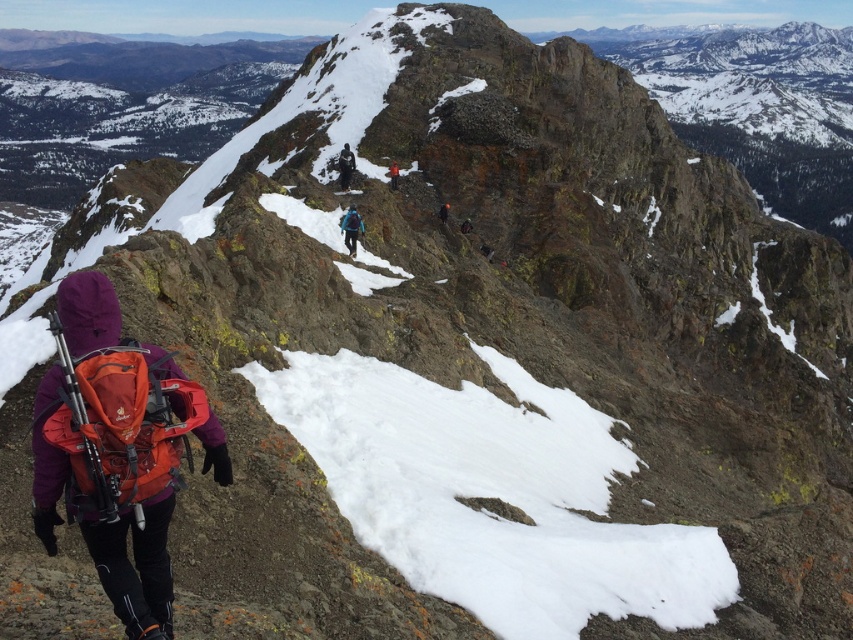
Question: Which point is farther to the camera?

Choices:
 (A) (344, 177)
 (B) (440, 209)
 (C) (352, 256)

Answer: (A)

Question: Which object appears farthest from the camera in this image?

Choices:
 (A) blue fabric backpack at center
 (B) orange fabric backpack at lower left

Answer: (A)

Question: Is blue fabric backpack at center to the left of dark blue jacket at center from the viewer's perspective?

Choices:
 (A) yes
 (B) no

Answer: (B)

Question: Is blue fabric backpack at center below black fabric jacket at upper center?

Choices:
 (A) no
 (B) yes

Answer: (B)

Question: Is dark blue jacket at center closer to the viewer compared to orange fabric jacket at center?

Choices:
 (A) no
 (B) yes

Answer: (B)

Question: Which of the following is the farthest from the observer?

Choices:
 (A) (161, 532)
 (B) (393, 180)
 (C) (341, 172)
 (D) (445, 221)

Answer: (B)